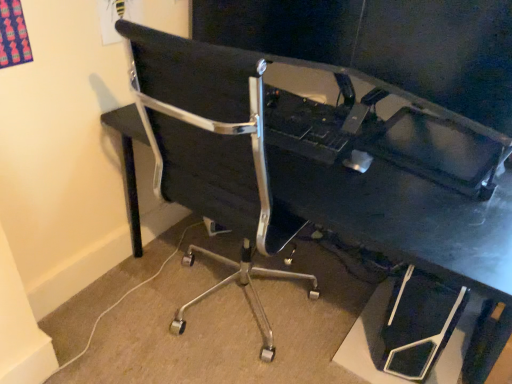
This screenshot has height=384, width=512. Describe the element at coordinates (441, 56) in the screenshot. I see `matte black monitor at center` at that location.

Where is `matte black monitor at center`? This screenshot has width=512, height=384. matte black monitor at center is located at coordinates (441, 56).

At what (x,y) coordinates should I click in order to perform the action: click on matte black monitor at center. Please return your answer as a coordinate pair (x, y). The height and width of the screenshot is (384, 512). Looking at the image, I should click on (441, 56).